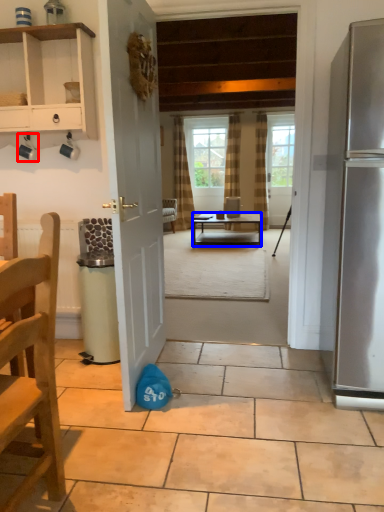
Question: Which object is closer to the camera taking this photo, coffee cup (highlighted by a red box) or desk (highlighted by a blue box)?

Choices:
 (A) coffee cup
 (B) desk

Answer: (A)